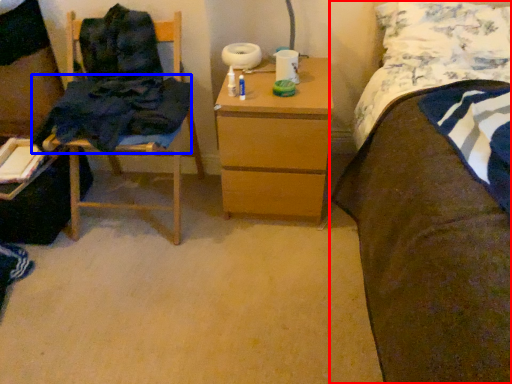
Question: Which object is closer to the camera taking this photo, bed (highlighted by a red box) or clothing (highlighted by a blue box)?

Choices:
 (A) bed
 (B) clothing

Answer: (A)